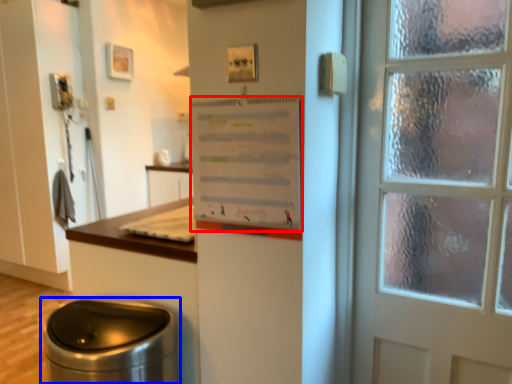
Question: Which of the following is the farthest to the observer, poster (highlighted by a red box) or waste container (highlighted by a blue box)?

Choices:
 (A) poster
 (B) waste container

Answer: (B)